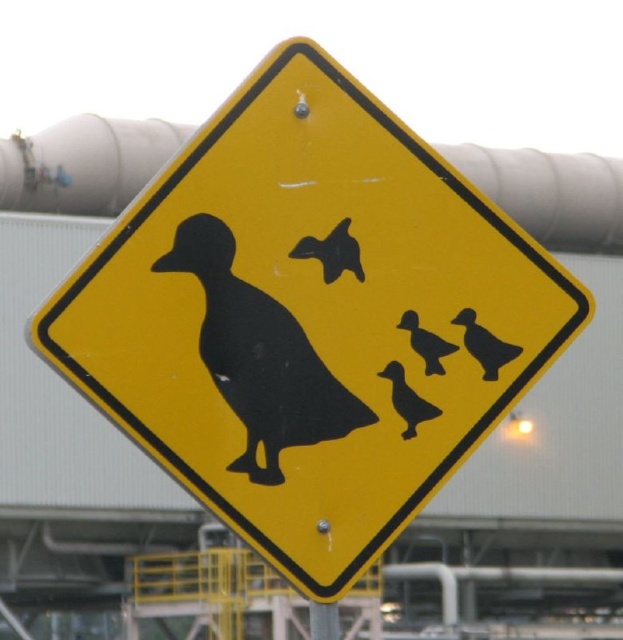
You are a photographer trying to capture a clear shot of the black matte duck at center. Your camera has a depth of field that can focus sharply on objects within 2.5 meters. Will the duck be in focus?

The black matte duck at center is 2.72 meters away from the camera, which is beyond the 2.5 meter depth of field range. Therefore, the duck will not be in focus.

You are standing in front of the road sign and want to determine the relative positions of two points marked on the sign. Which point is closer to you, point (500,349) or point (414,348)?

Point (414,348) is closer to you because it is less further to the viewer than point (500,349).